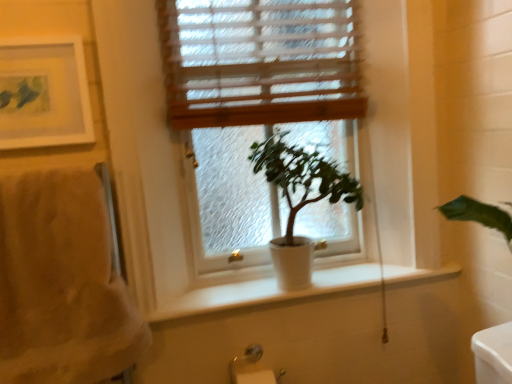
Question: Should I look upward or downward to see wooden blinds at upper center?

Choices:
 (A) down
 (B) up

Answer: (B)

Question: Does matte white picture frame at upper left lie behind silver metallic towel bar at lower left?

Choices:
 (A) no
 (B) yes

Answer: (A)

Question: Considering the relative sizes of matte white picture frame at upper left and silver metallic towel bar at lower left in the image provided, is matte white picture frame at upper left bigger than silver metallic towel bar at lower left?

Choices:
 (A) no
 (B) yes

Answer: (B)

Question: Considering the relative sizes of matte white picture frame at upper left and silver metallic towel bar at lower left in the image provided, is matte white picture frame at upper left taller than silver metallic towel bar at lower left?

Choices:
 (A) yes
 (B) no

Answer: (A)

Question: Considering the relative sizes of matte white picture frame at upper left and silver metallic towel bar at lower left in the image provided, is matte white picture frame at upper left thinner than silver metallic towel bar at lower left?

Choices:
 (A) no
 (B) yes

Answer: (B)

Question: Is matte white picture frame at upper left facing away from silver metallic towel bar at lower left?

Choices:
 (A) no
 (B) yes

Answer: (A)

Question: Is matte white picture frame at upper left aimed at silver metallic towel bar at lower left?

Choices:
 (A) no
 (B) yes

Answer: (A)

Question: Is matte white picture frame at upper left to the left of beige fluffy towel at left from the viewer's perspective?

Choices:
 (A) no
 (B) yes

Answer: (B)

Question: Can you confirm if matte white picture frame at upper left is smaller than beige fluffy towel at left?

Choices:
 (A) no
 (B) yes

Answer: (B)

Question: Can you confirm if matte white picture frame at upper left is thinner than beige fluffy towel at left?

Choices:
 (A) no
 (B) yes

Answer: (B)

Question: Does matte white picture frame at upper left have a greater width compared to beige fluffy towel at left?

Choices:
 (A) no
 (B) yes

Answer: (A)

Question: Is matte white picture frame at upper left positioned far away from beige fluffy towel at left?

Choices:
 (A) no
 (B) yes

Answer: (A)

Question: Is matte white picture frame at upper left looking in the opposite direction of beige fluffy towel at left?

Choices:
 (A) yes
 (B) no

Answer: (B)

Question: Is green matte plant at center placed right next to silver metallic towel bar at lower left?

Choices:
 (A) no
 (B) yes

Answer: (A)